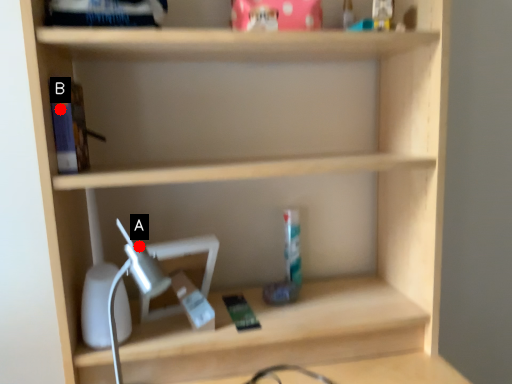
Question: Two points are circled on the image, labeled by A and B beside each circle. Which of the following is the farthest from the observer?

Choices:
 (A) A is further
 (B) B is further

Answer: (A)